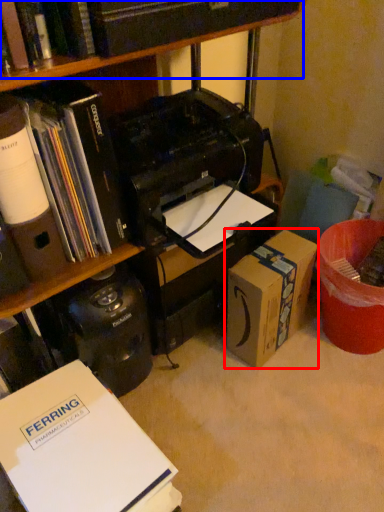
Question: Among these objects, which one is farthest to the camera, box (highlighted by a red box) or book (highlighted by a blue box)?

Choices:
 (A) box
 (B) book

Answer: (A)